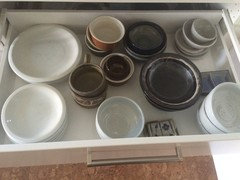
What are the coordinates of `black clay pot` in the screenshot? It's located at (144, 40).